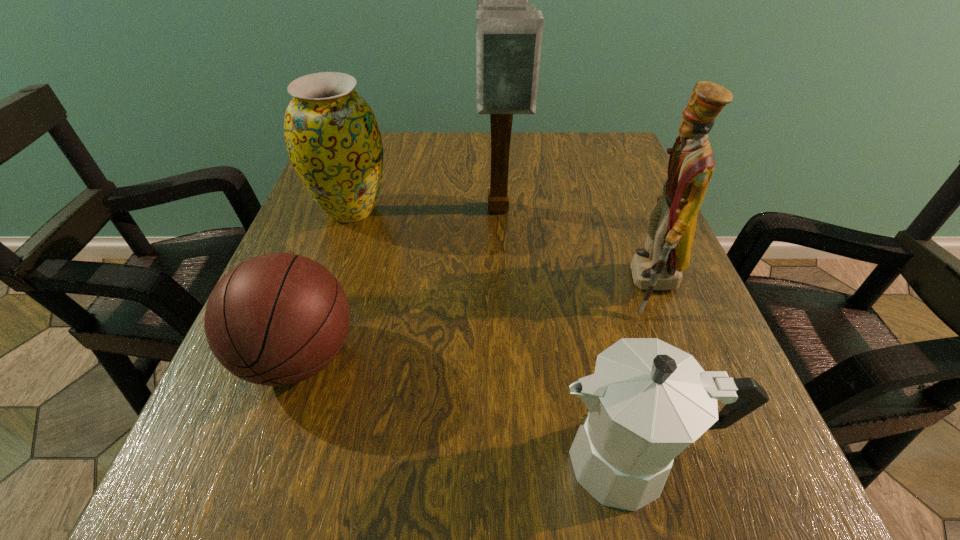
This screenshot has width=960, height=540. I want to click on coffeepot situated at the right edge, so click(648, 400).

This screenshot has height=540, width=960. What are the coordinates of `object present at the near right corner` in the screenshot? It's located at (648, 400).

In the image, there is a desktop. Where is `vacant space at the far edge`? vacant space at the far edge is located at coordinates (456, 183).

Locate an element on the screen. The height and width of the screenshot is (540, 960). free spot at the near edge of the desktop is located at coordinates (513, 465).

In the image, there is a desktop. Identify the location of vacant space at the left edge. (328, 234).

Identify the location of free space at the right edge of the desktop. (641, 206).

Locate an element on the screen. This screenshot has width=960, height=540. free space at the far left corner of the desktop is located at coordinates (391, 148).

This screenshot has height=540, width=960. Identify the location of blank space at the far right corner of the desktop. (593, 174).

Find the location of a particular element. Image resolution: width=960 pixels, height=540 pixels. vacant area at the near right corner is located at coordinates (754, 518).

Locate an element on the screen. vacant area between the mallet and the coffeepot is located at coordinates (564, 336).